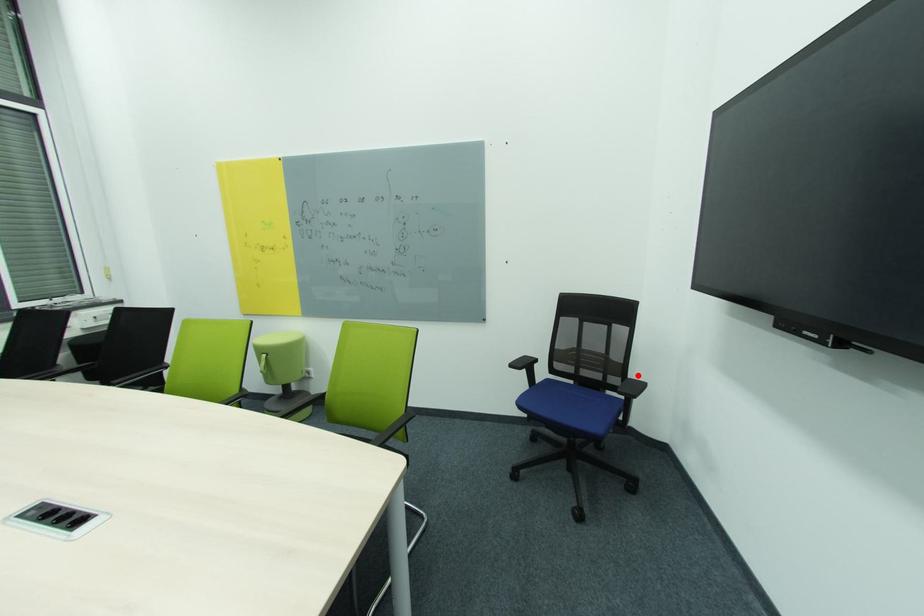
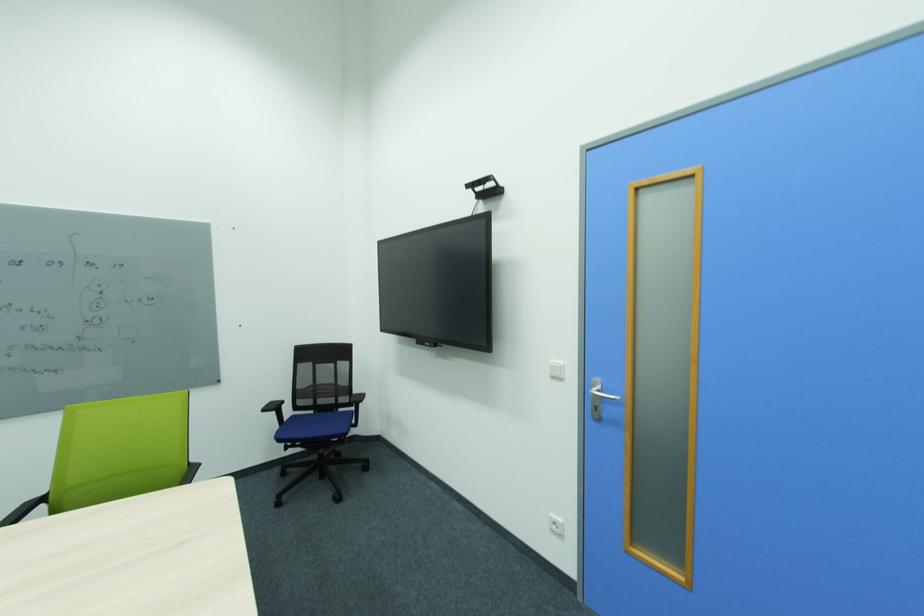
Question: I am providing you with two images of the same scene from different viewpoints. A red point is marked on the first image. Is the red point's position out of view in image 2?

Choices:
 (A) Yes
 (B) No

Answer: (B)